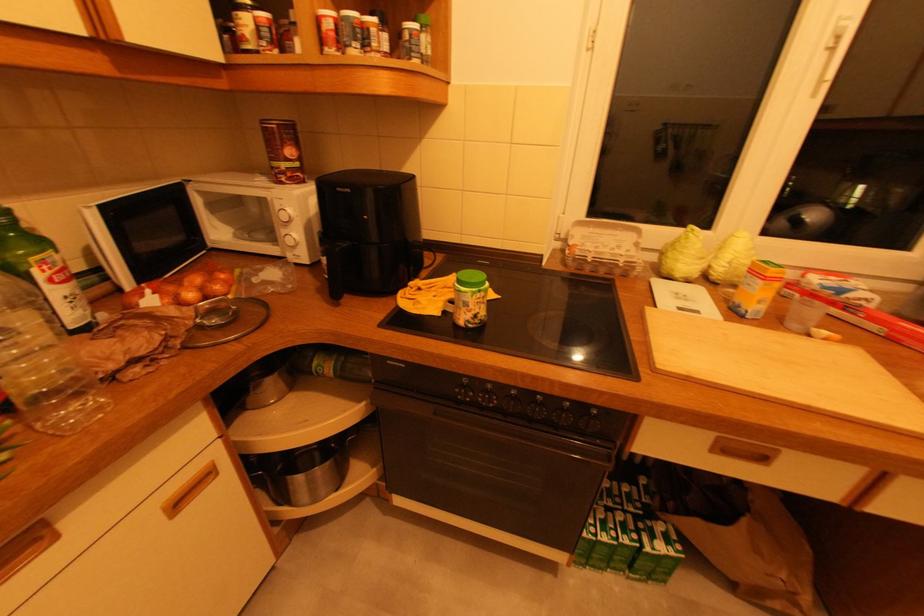
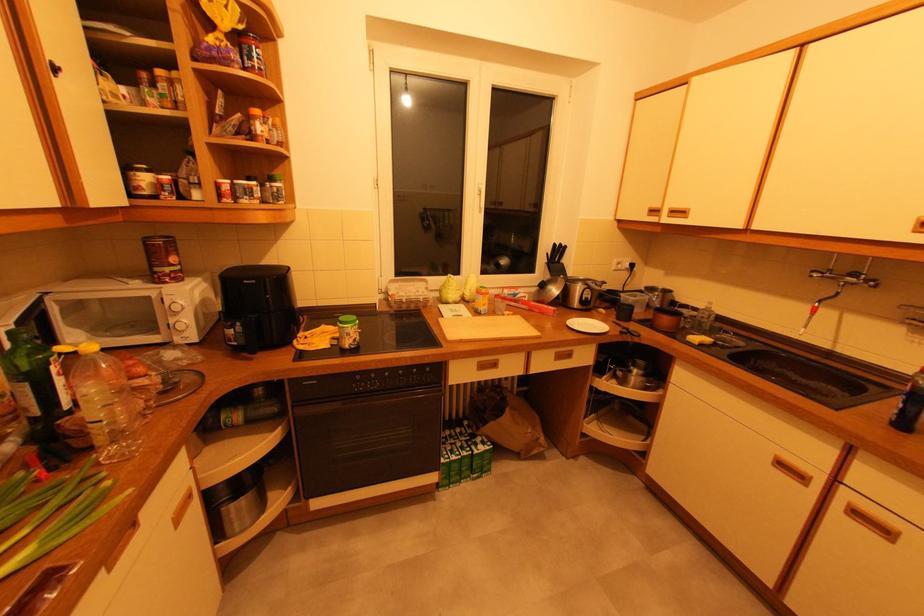
Locate, in the second image, the point that corresponds to point 592,261 in the first image.

(407, 302)